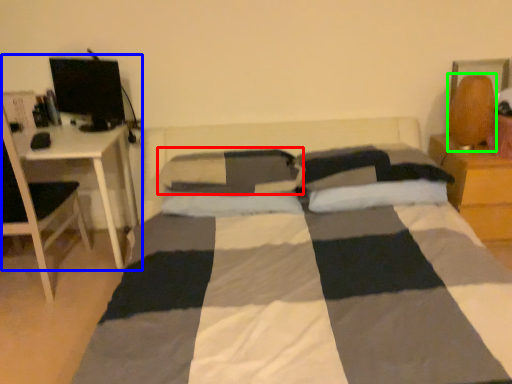
Question: Which object is the farthest from pillow (highlighted by a red box)? Choose among these: computer desk (highlighted by a blue box) or table lamp (highlighted by a green box).

Choices:
 (A) computer desk
 (B) table lamp

Answer: (B)